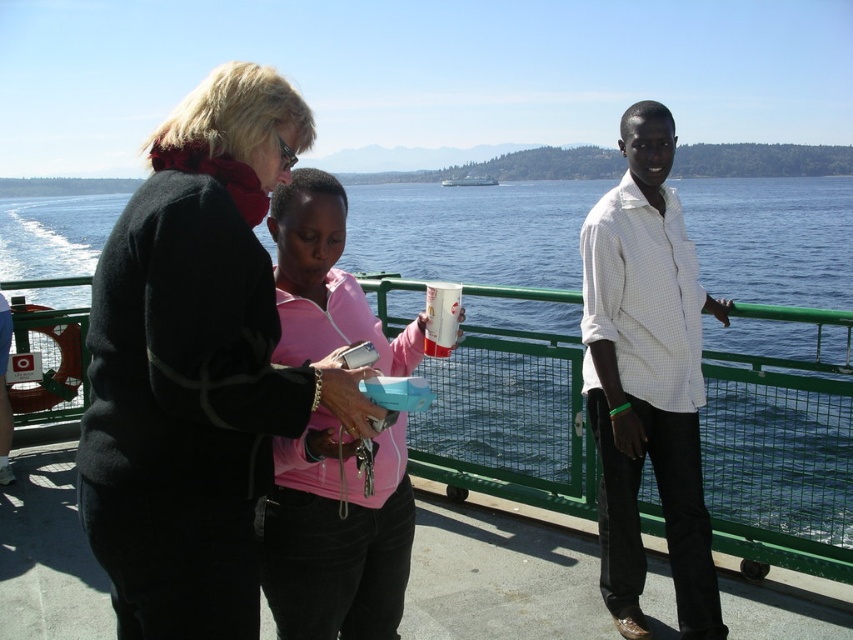
Question: Is matte black jacket at center bigger than green metal railing at center?

Choices:
 (A) no
 (B) yes

Answer: (B)

Question: Among these objects, which one is nearest to the camera?

Choices:
 (A) white checkered shirt at center
 (B) matte black jacket at center
 (C) green metal railing at center
 (D) white glossy cup at center

Answer: (B)

Question: Which point is farther to the camera?

Choices:
 (A) green metal railing at center
 (B) matte black jacket at center

Answer: (A)

Question: Which of these objects is positioned farthest from the green metal railing at center?

Choices:
 (A) matte black jacket at center
 (B) white checkered shirt at center

Answer: (A)

Question: Can you confirm if green metal railing at center is positioned to the right of white glossy cup at center?

Choices:
 (A) no
 (B) yes

Answer: (A)

Question: Is white checkered shirt at center to the left of matte pink hoodie at center from the viewer's perspective?

Choices:
 (A) yes
 (B) no

Answer: (B)